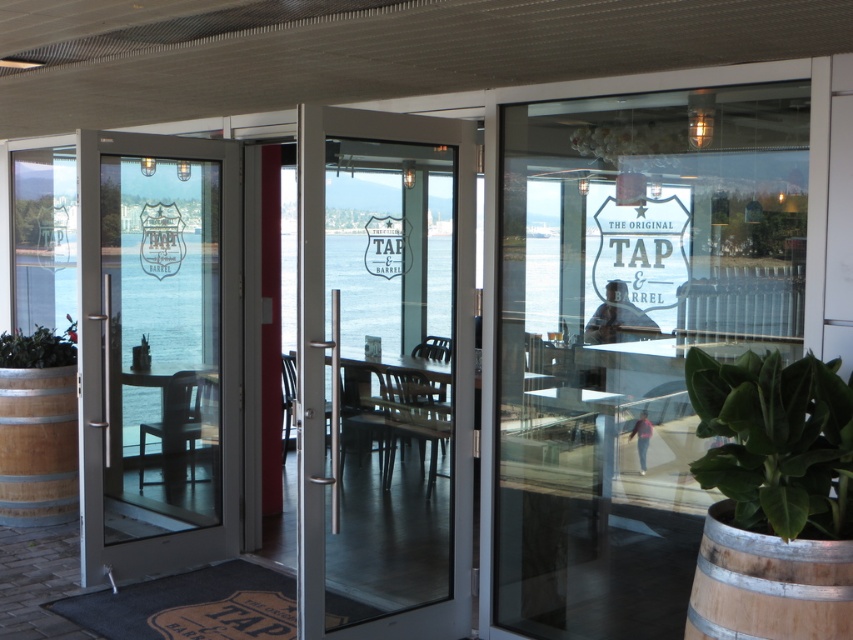
Between wooden chair at center and metallic silver chair at center, which one is positioned higher?

Positioned higher is wooden chair at center.

Is wooden chair at center above metallic silver chair at center?

Indeed, wooden chair at center is positioned over metallic silver chair at center.

Between point (425, 394) and point (292, 356), which one is positioned in front?

Point (425, 394) is more forward.

This screenshot has width=853, height=640. I want to click on wooden chair at center, so click(x=415, y=419).

Does green leafy plant at lower right appear on the left side of wooden chair at center?

No, green leafy plant at lower right is not to the left of wooden chair at center.

Describe the element at coordinates (776, 442) in the screenshot. I see `green leafy plant at lower right` at that location.

The width and height of the screenshot is (853, 640). Identify the location of green leafy plant at lower right. (776, 442).

Can you confirm if transparent glass door at center is positioned below clear glass door at left?

Correct, transparent glass door at center is located below clear glass door at left.

Looking at this image, measure the distance between transparent glass door at center and camera.

3.37 meters

I want to click on transparent glass door at center, so click(630, 333).